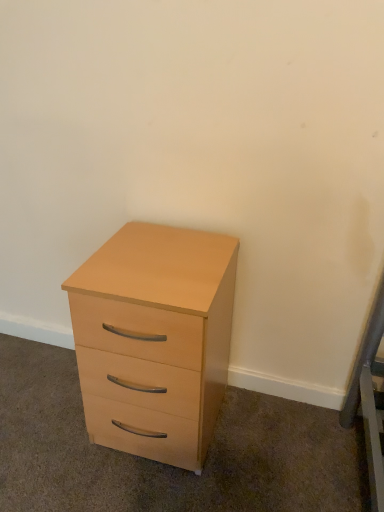
Image resolution: width=384 pixels, height=512 pixels. Find the location of `vacant area that lies to the right of light wood/veneer chest of drawers at lower left`. vacant area that lies to the right of light wood/veneer chest of drawers at lower left is located at coordinates (264, 440).